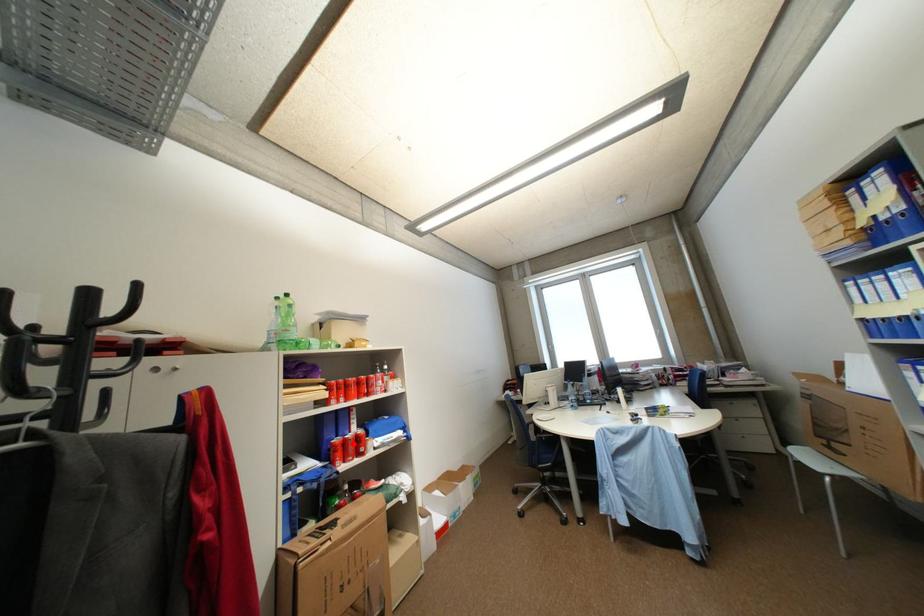
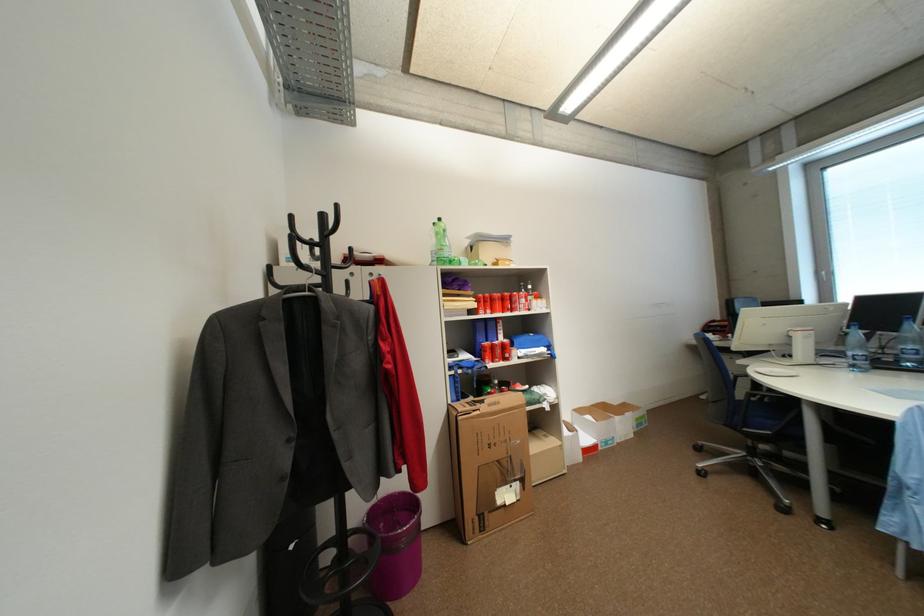
Locate, in the second image, the point that corresponds to the highlighted location in the first image.

(502, 347)